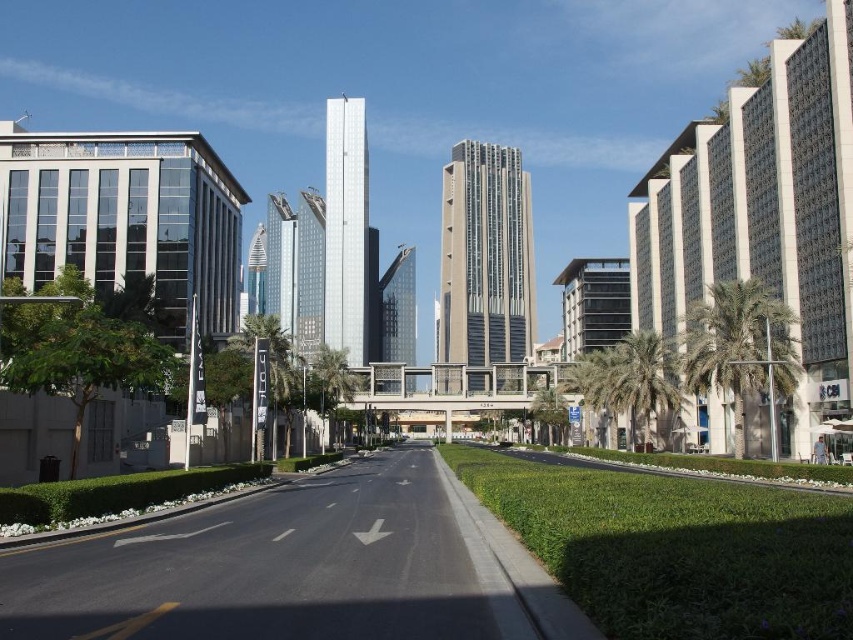
You are a drone operator trying to fly a drone between the two palm trees. The green leafy palm tree at right and the green leafy palm tree at left. Which direction should you fly the drone to avoid hitting the tree that is further away from you?

The green leafy palm tree at right is positioned over the green leafy palm tree at left, so to avoid hitting the tree further away, fly the drone towards the left side since the right tree is closer and the left tree is further back.